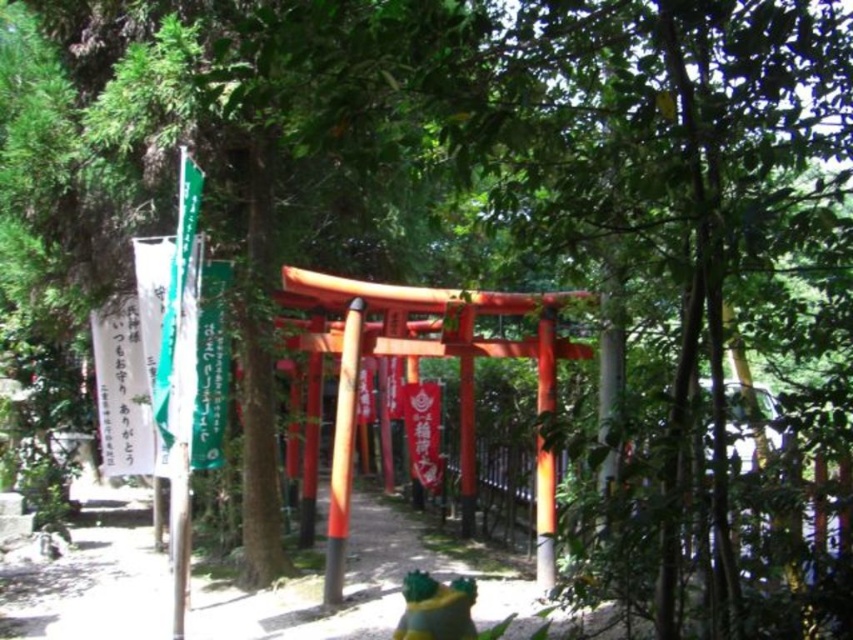
In the scene shown: Is orange glossy pole at center to the left of glossy wood pole at center from the viewer's perspective?

Indeed, orange glossy pole at center is positioned on the left side of glossy wood pole at center.

Between orange glossy pole at center and glossy wood pole at center, which one has less height?

With less height is glossy wood pole at center.

Does point (335, 445) come closer to viewer compared to point (535, 464)?

Yes, point (335, 445) is in front of point (535, 464).

The height and width of the screenshot is (640, 853). What are the coordinates of `orange glossy pole at center` in the screenshot? It's located at (341, 454).